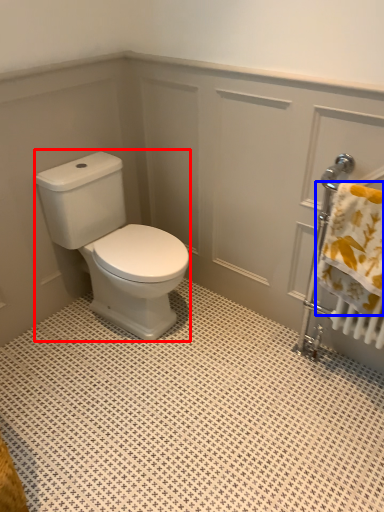
Question: Which of the following is the closest to the observer, porcelain (highlighted by a red box) or bath towel (highlighted by a blue box)?

Choices:
 (A) porcelain
 (B) bath towel

Answer: (B)